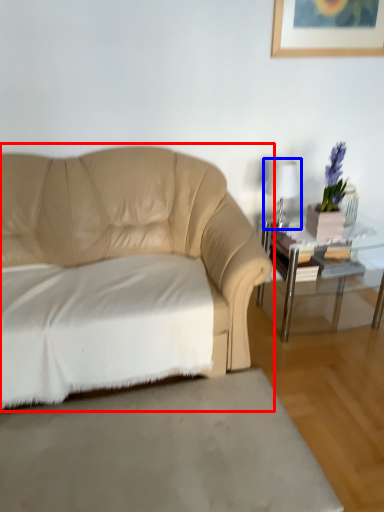
Question: Which of the following is the farthest to the observer, studio couch (highlighted by a red box) or table lamp (highlighted by a blue box)?

Choices:
 (A) studio couch
 (B) table lamp

Answer: (B)